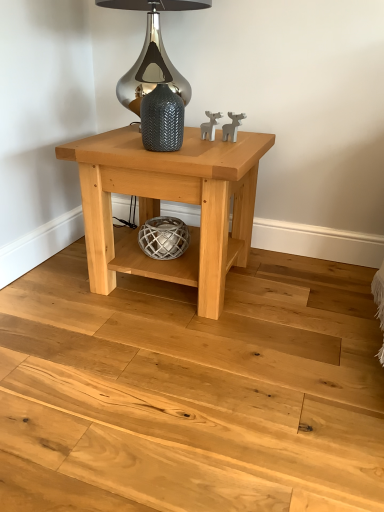
Question: Can you confirm if satin silver glass at upper center is smaller than natural wood table at center?

Choices:
 (A) yes
 (B) no

Answer: (A)

Question: Can you confirm if satin silver glass at upper center is taller than natural wood table at center?

Choices:
 (A) no
 (B) yes

Answer: (A)

Question: Is satin silver glass at upper center aimed at natural wood table at center?

Choices:
 (A) no
 (B) yes

Answer: (A)

Question: Is satin silver glass at upper center positioned behind natural wood table at center?

Choices:
 (A) yes
 (B) no

Answer: (A)

Question: Is the depth of satin silver glass at upper center less than that of natural wood table at center?

Choices:
 (A) no
 (B) yes

Answer: (A)

Question: Does satin silver glass at upper center have a lesser height compared to natural wood table at center?

Choices:
 (A) no
 (B) yes

Answer: (B)

Question: Does textured gray vase at center have a greater width compared to natural wood floor at center?

Choices:
 (A) no
 (B) yes

Answer: (A)

Question: Is textured gray vase at center to the left of natural wood floor at center from the viewer's perspective?

Choices:
 (A) no
 (B) yes

Answer: (B)

Question: Considering the relative sizes of textured gray vase at center and natural wood floor at center in the image provided, is textured gray vase at center taller than natural wood floor at center?

Choices:
 (A) yes
 (B) no

Answer: (A)

Question: Can you confirm if textured gray vase at center is thinner than natural wood floor at center?

Choices:
 (A) yes
 (B) no

Answer: (A)

Question: Is textured gray vase at center aimed at natural wood floor at center?

Choices:
 (A) no
 (B) yes

Answer: (A)

Question: Does textured gray vase at center have a smaller size compared to natural wood floor at center?

Choices:
 (A) no
 (B) yes

Answer: (B)

Question: Is natural wood table at center completely or partially inside natural wood floor at center?

Choices:
 (A) no
 (B) yes

Answer: (A)